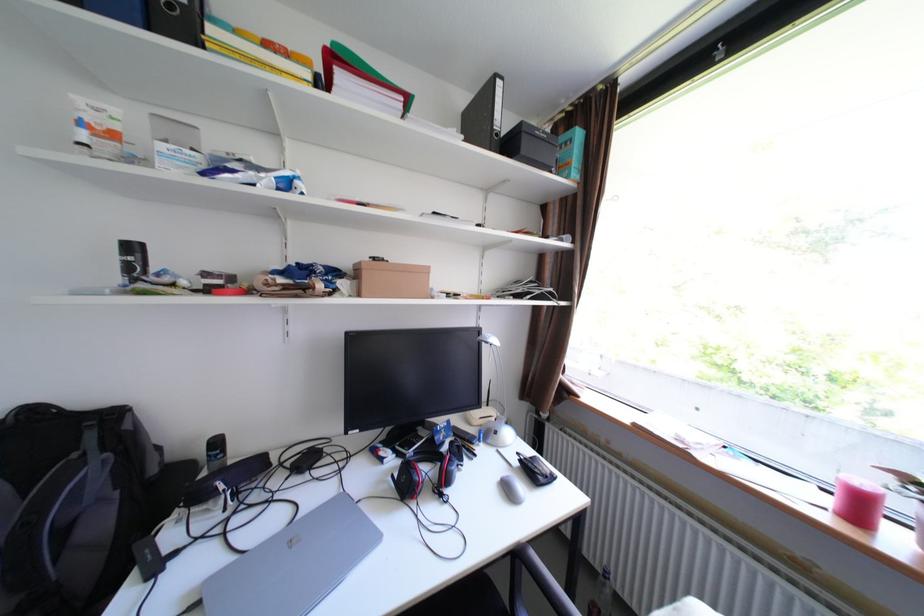
Where would you lift the black spray can? Please return your answer as a coordinate pair (x, y).

(131, 260)